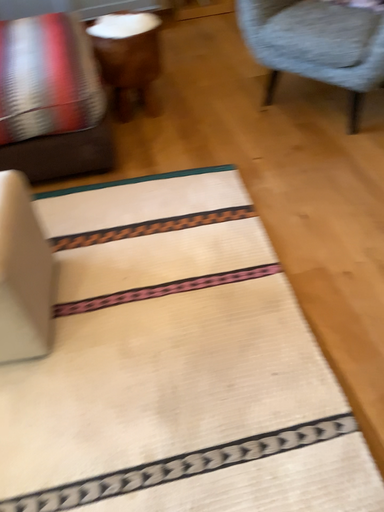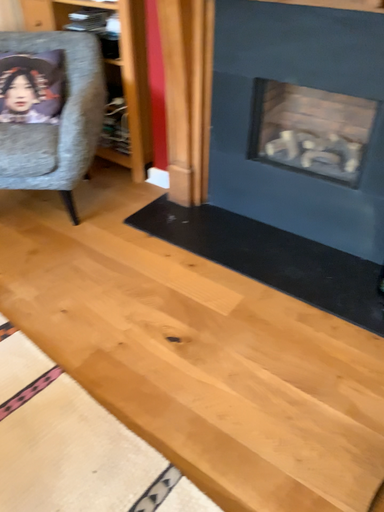
Question: Which way did the camera rotate in the video?

Choices:
 (A) rotated downward
 (B) rotated upward

Answer: (B)